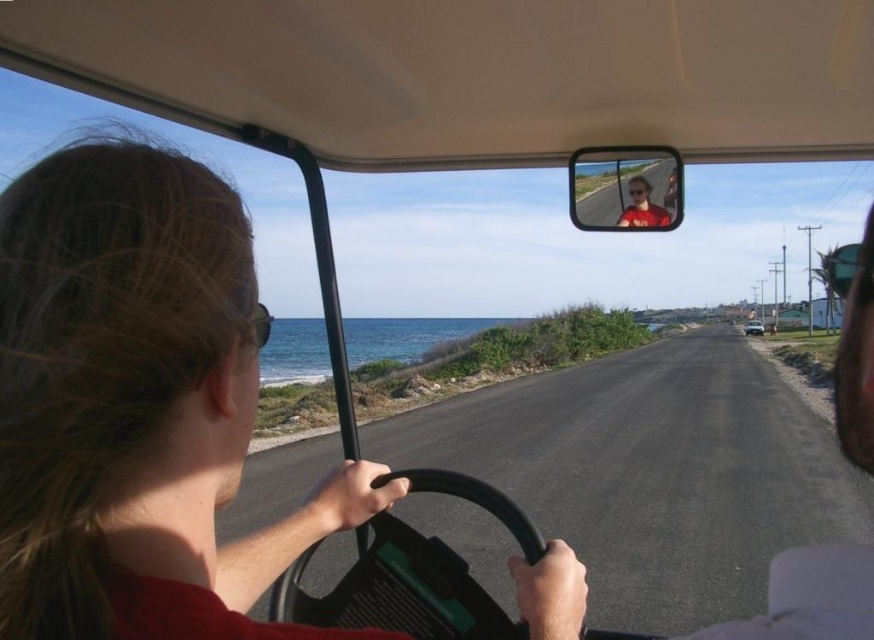
You are a passenger in the vehicle and need to locate the matte red shirt at center. Based on the scene description, where would you expect to find it?

The matte red shirt at center is positioned at point coordinates of (x=810, y=596), which is likely near the driver since the driver is wearing a matte red shirt at center.

Looking at this image, you are a passenger sitting in the back seat of the vehicle and want to know if the two points marked on the windshield are aligned along the same path. Based on their positions, can you determine if point (649,198) is closer to you than point (758,323)?

Point (649,198) is in front of point (758,323), so it is closer to you as a passenger in the back seat.

You are a passenger in the vehicle and want to check your phone, which is on the dashboard. To do this, you need to move either the matte red shirt at center or the matte black rearview mirror at upper center. Which object do you need to move to access the phone?

You need to move the matte black rearview mirror at upper center because the matte red shirt at center is positioned to the right of it, meaning the rearview mirror is blocking the path to the phone on the dashboard.